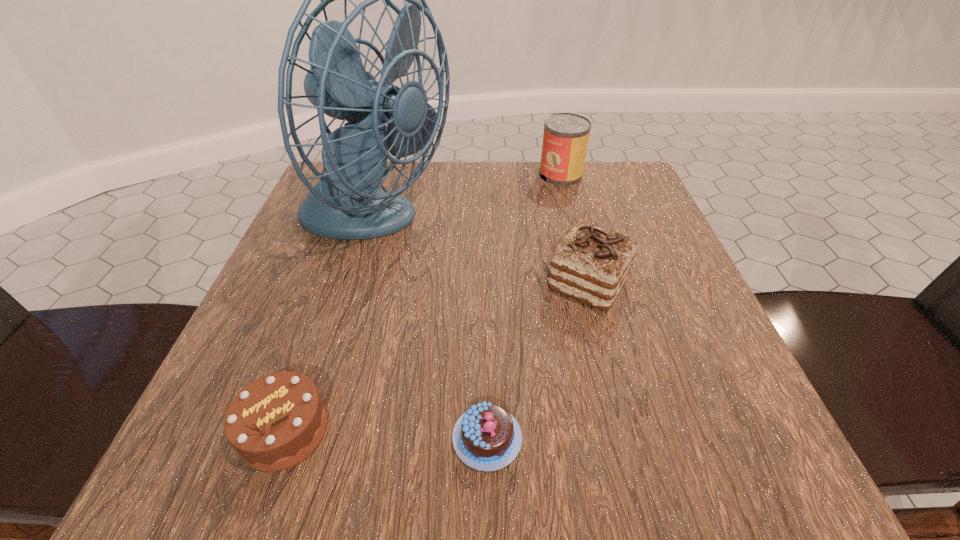
Where is `vacant space located on the front of the tallest chocolate cake`? Image resolution: width=960 pixels, height=540 pixels. vacant space located on the front of the tallest chocolate cake is located at coordinates (639, 484).

Where is `free spot located on the back of the fourth tallest object`? The height and width of the screenshot is (540, 960). free spot located on the back of the fourth tallest object is located at coordinates (333, 292).

Locate an element on the screen. This screenshot has height=540, width=960. free spot located on the left of the shortest object is located at coordinates (374, 438).

You are a GUI agent. You are given a task and a screenshot of the screen. Output one action in this format:
    pyautogui.click(x=<x>, y=<y>)
    Task: Click on the fan situated at the far edge
    This screenshot has height=540, width=960.
    Given the screenshot: What is the action you would take?
    pyautogui.click(x=345, y=204)

I want to click on can that is at the far edge, so click(565, 139).

You are a GUI agent. You are given a task and a screenshot of the screen. Output one action in this format:
    pyautogui.click(x=<x>, y=<y>)
    Task: Click on the fan that is positioned at the left edge
    Image resolution: width=960 pixels, height=540 pixels.
    Given the screenshot: What is the action you would take?
    pos(345,204)

Find the location of a particular element. The image size is (960, 540). chocolate cake that is positioned at the left edge is located at coordinates (275, 422).

The height and width of the screenshot is (540, 960). Identify the location of can at the right edge. 565,139.

Where is `chocolate cake at the right edge`? Image resolution: width=960 pixels, height=540 pixels. chocolate cake at the right edge is located at coordinates (591, 264).

This screenshot has width=960, height=540. Identify the location of object that is at the far left corner. (345, 204).